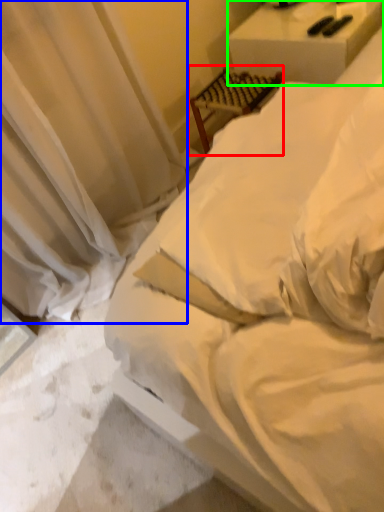
Question: Which object is positioned closest to furniture (highlighted by a red box)? Select from curtain (highlighted by a blue box) and furniture (highlighted by a green box).

Choices:
 (A) curtain
 (B) furniture

Answer: (B)